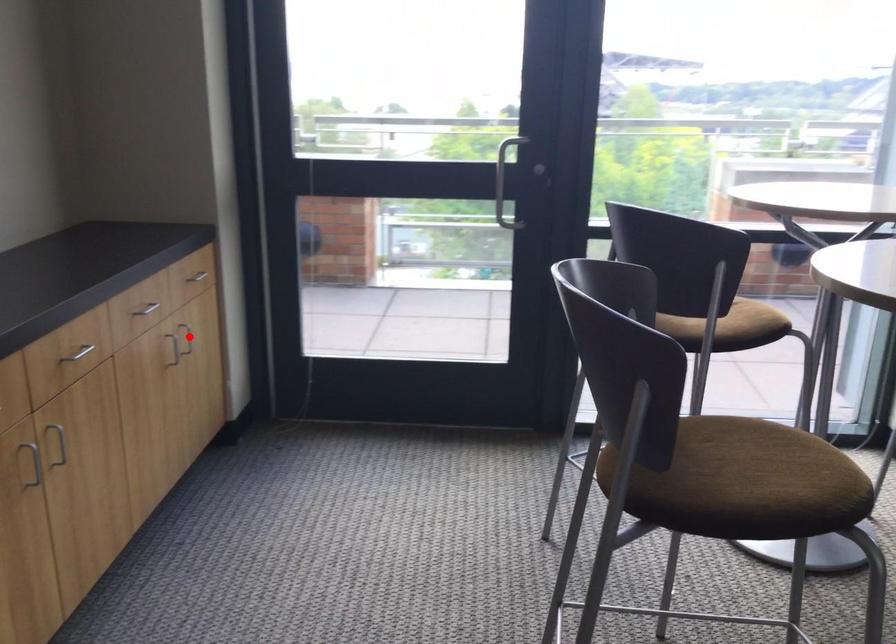
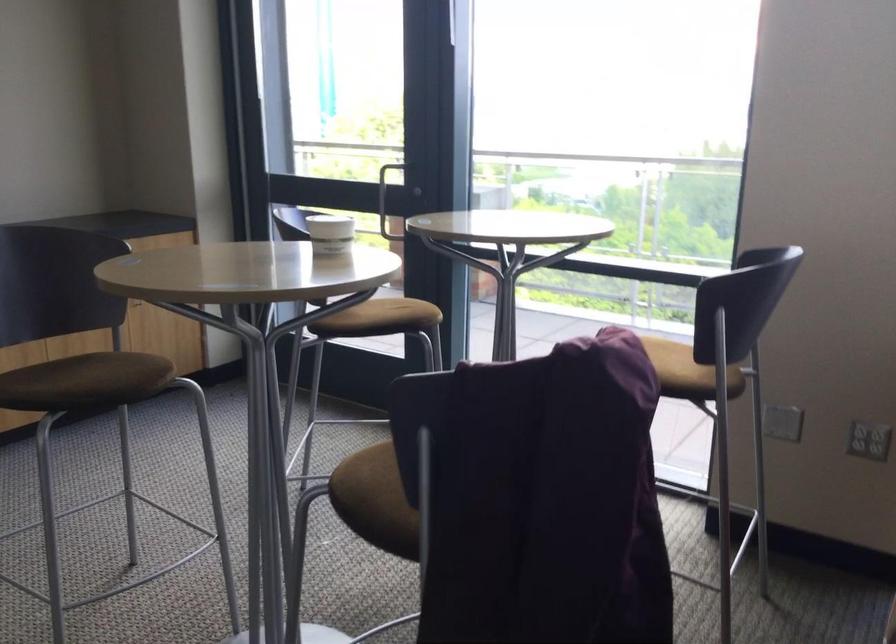
Question: I am providing you with two images of the same scene from different viewpoints. A red point is marked on the first image. At the location where the point appears in image 1, is it still visible in image 2?

Choices:
 (A) Yes
 (B) No

Answer: (B)